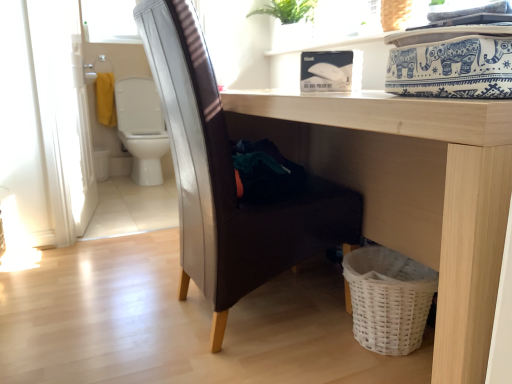
Locate an element on the screen. The height and width of the screenshot is (384, 512). free region on the left part of leather-like brown chair at center is located at coordinates (97, 324).